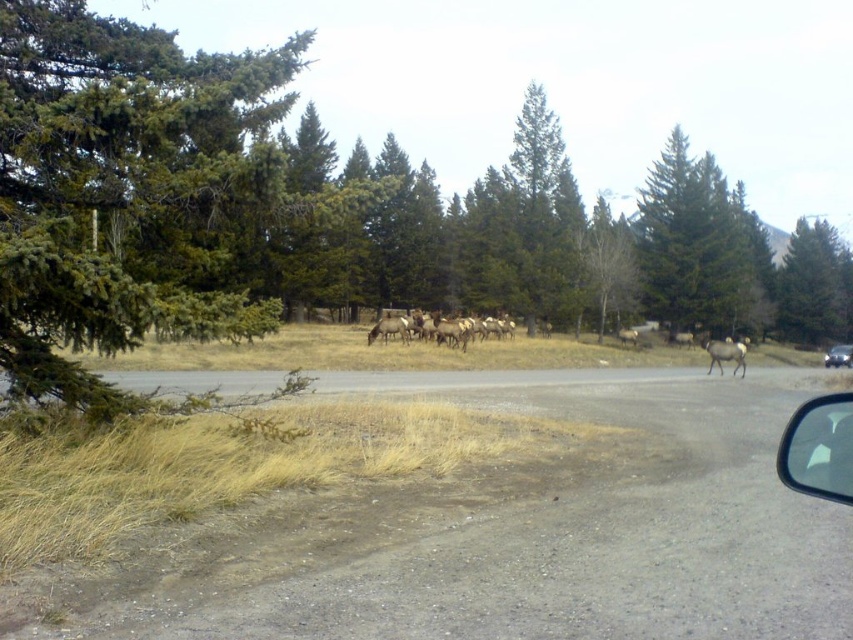
You are driving on a dirt road and see a group of elk grazing in a grassy area surrounded by dense evergreen trees. There is a point marked at coordinates (300, 211). What object is located at that point?

The point at coordinates (300, 211) marks a green textured tree at upper left.

Based on the photo, you are inside a car driving on a dirt road and notice two points in the scene. The first point is at coordinate point (47, 362) and the second is at point (833, 352). Based on your current position, which point is closer to you?

Point (47, 362) is closer to the viewer than point (833, 352).

You are a photographer trying to capture the green matte tree at upper center in your shot. Based on the scene, where should you position your camera to ensure the tree is centered in the frame?

To center the green matte tree at upper center in the frame, position your camera so that the tree is aligned with the center point of your viewfinder at coordinates approximately 0.384 on the x axis and 0.821 on the y axis.